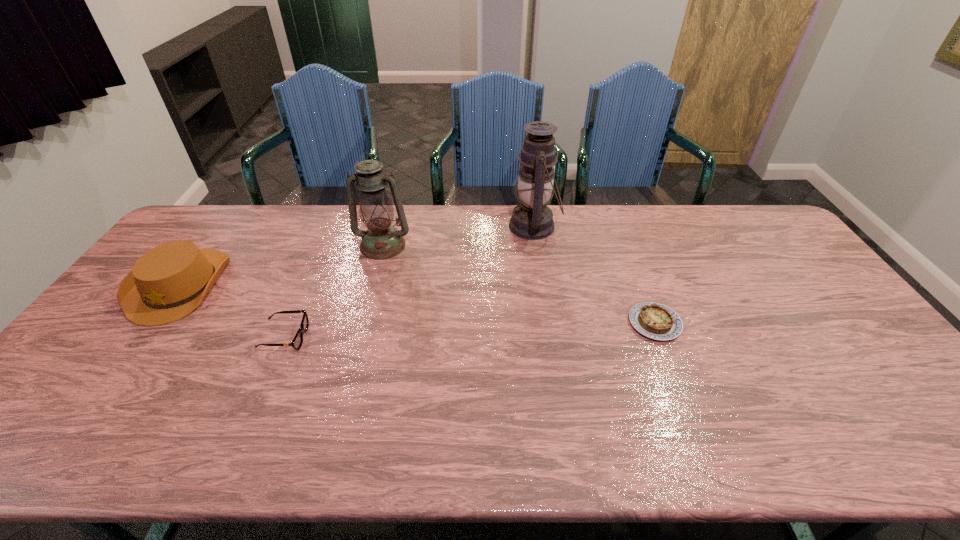
The height and width of the screenshot is (540, 960). I want to click on unoccupied area between the shortest object and the fourth object from right to left, so click(470, 330).

You are a GUI agent. You are given a task and a screenshot of the screen. Output one action in this format:
    pyautogui.click(x=<x>, y=<y>)
    Task: Click on the vacant area that lies between the second object from left to right and the left oil lamp
    The image size is (960, 540).
    Given the screenshot: What is the action you would take?
    pyautogui.click(x=334, y=291)

The width and height of the screenshot is (960, 540). In order to click on unoccupied area between the leftmost object and the fourth object from left to right in this screenshot , I will do `click(357, 255)`.

Image resolution: width=960 pixels, height=540 pixels. Find the location of `free space that is in between the fourth object from left to right and the cowboy hat`. free space that is in between the fourth object from left to right and the cowboy hat is located at coordinates (357, 255).

Where is `unoccupied area between the third object from left to right and the second object from right to left`? This screenshot has height=540, width=960. unoccupied area between the third object from left to right and the second object from right to left is located at coordinates (459, 236).

Where is `vacant space that's between the fourth object from left to right and the third object from right to left`? This screenshot has width=960, height=540. vacant space that's between the fourth object from left to right and the third object from right to left is located at coordinates (459, 236).

Locate an element on the screen. The width and height of the screenshot is (960, 540). vacant point located between the right oil lamp and the second tallest object is located at coordinates (459, 236).

Locate an element on the screen. This screenshot has height=540, width=960. free space between the rightmost object and the right oil lamp is located at coordinates (594, 275).

Identify which object is the fourth nearest to the second object from right to left. Please provide its 2D coordinates. Your answer should be formatted as a tuple, i.e. [(x, y)], where the tuple contains the x and y coordinates of a point satisfying the conditions above.

[(168, 282)]

Locate which object is the fourth closest to the shorter oil lamp. Please provide its 2D coordinates. Your answer should be formatted as a tuple, i.e. [(x, y)], where the tuple contains the x and y coordinates of a point satisfying the conditions above.

[(653, 320)]